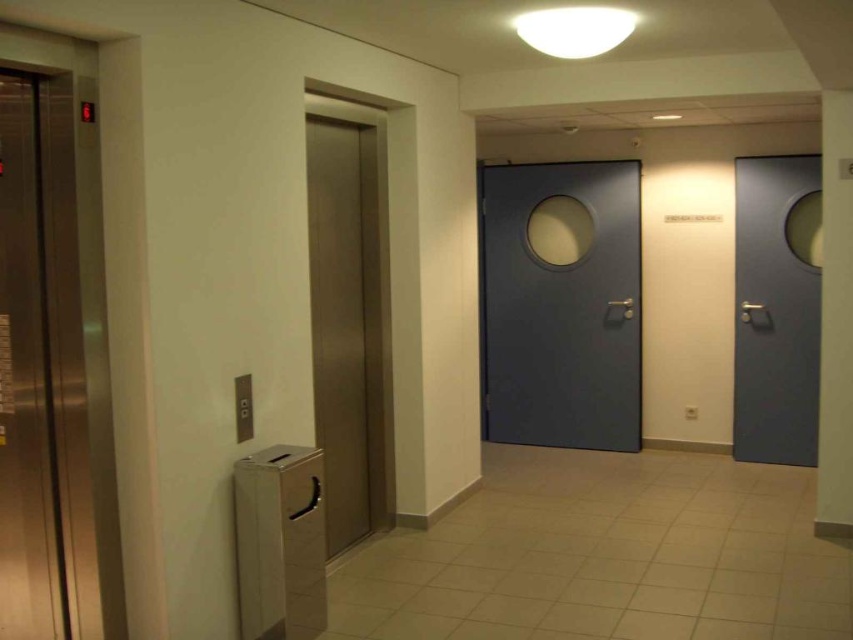
Question: Is polished stainless steel elevator at left to the right of wooden door at center from the viewer's perspective?

Choices:
 (A) yes
 (B) no

Answer: (B)

Question: Does matte gray door at center appear over metallic silver trash can at lower left?

Choices:
 (A) no
 (B) yes

Answer: (B)

Question: Which of these objects is positioned closest to the polished stainless steel elevator at left?

Choices:
 (A) metallic silver trash can at lower left
 (B) matte gray door at center
 (C) matte gray door at right

Answer: (A)

Question: Which is farther from the metallic silver trash can at lower left?

Choices:
 (A) matte gray door at right
 (B) matte gray door at center
 (C) polished stainless steel elevator at left
 (D) wooden door at center

Answer: (A)

Question: Estimate the real-world distances between objects in this image. Which object is farther from the matte gray door at center?

Choices:
 (A) metallic silver trash can at lower left
 (B) wooden door at center
 (C) matte gray door at right

Answer: (A)

Question: Does matte gray door at center appear on the left side of matte gray door at right?

Choices:
 (A) yes
 (B) no

Answer: (A)